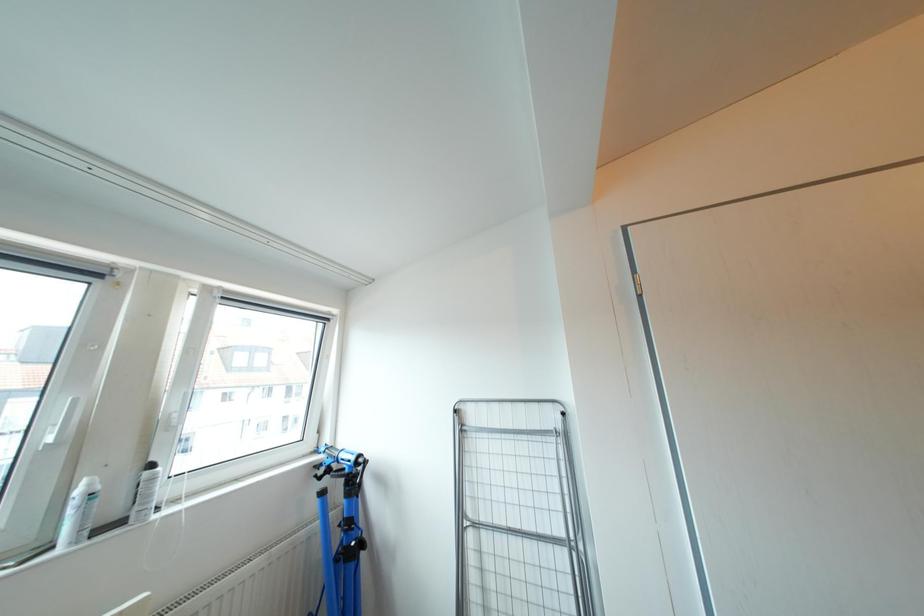
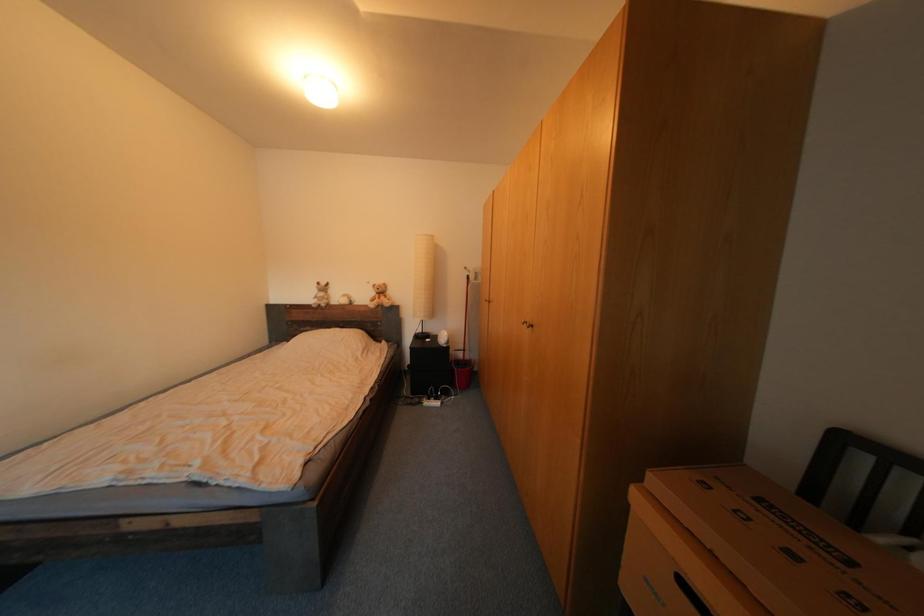
Question: Based on the continuous images, in which direction is the camera rotating? Reply with the corresponding letter.

Choices:
 (A) Left
 (B) Right
 (C) Up
 (D) Down

Answer: (B)